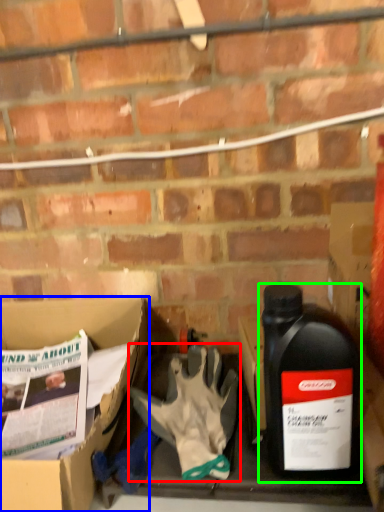
Question: Which object is the farthest from glove (highlighted by a red box)? Choose among these: box (highlighted by a blue box) or bottle (highlighted by a green box).

Choices:
 (A) box
 (B) bottle

Answer: (A)